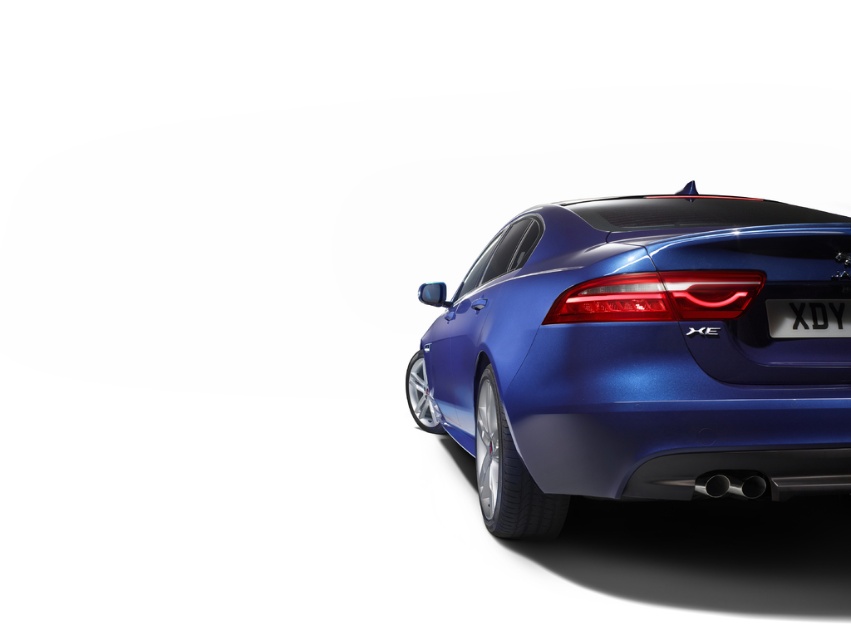
Is glossy metallic car at center positioned at the back of matte red tail light at center?

No, glossy metallic car at center is in front of matte red tail light at center.

The width and height of the screenshot is (851, 640). In order to click on glossy metallic car at center in this screenshot , I will do `click(638, 356)`.

Locate an element on the screen. glossy metallic car at center is located at coordinates (638, 356).

Locate an element on the screen. This screenshot has width=851, height=640. glossy metallic car at center is located at coordinates (638, 356).

Who is taller, glossy metallic car at center or black plastic license plate at center?

With more height is glossy metallic car at center.

What do you see at coordinates (638, 356) in the screenshot? Image resolution: width=851 pixels, height=640 pixels. I see `glossy metallic car at center` at bounding box center [638, 356].

I want to click on glossy metallic car at center, so click(638, 356).

Does matte red tail light at center have a lesser height compared to black plastic license plate at center?

In fact, matte red tail light at center may be taller than black plastic license plate at center.

Can you confirm if matte red tail light at center is positioned to the left of black plastic license plate at center?

Indeed, matte red tail light at center is positioned on the left side of black plastic license plate at center.

Where is `matte red tail light at center`? matte red tail light at center is located at coordinates (657, 296).